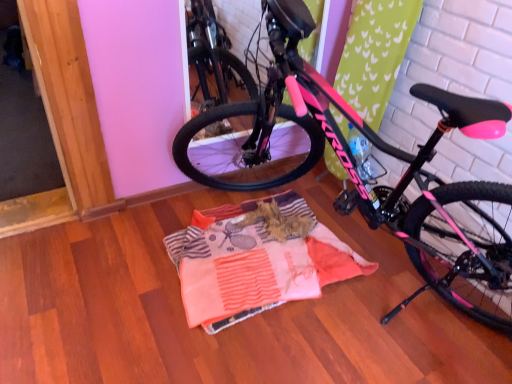
Question: Does striped cotton blanket at center have a smaller size compared to pink matte bicycle at center?

Choices:
 (A) yes
 (B) no

Answer: (A)

Question: Is striped cotton blanket at center far from pink matte bicycle at center?

Choices:
 (A) yes
 (B) no

Answer: (B)

Question: Is striped cotton blanket at center bigger than pink matte bicycle at center?

Choices:
 (A) no
 (B) yes

Answer: (A)

Question: Is striped cotton blanket at center closer to the viewer compared to pink matte bicycle at center?

Choices:
 (A) yes
 (B) no

Answer: (B)

Question: Is striped cotton blanket at center not within pink matte bicycle at center?

Choices:
 (A) no
 (B) yes

Answer: (A)

Question: Is striped cotton blanket at center with pink matte bicycle at center?

Choices:
 (A) no
 (B) yes

Answer: (A)

Question: Is pink matte bicycle at center oriented away from striped cotton blanket at center?

Choices:
 (A) no
 (B) yes

Answer: (A)

Question: Does pink matte bicycle at center have a lesser width compared to striped cotton blanket at center?

Choices:
 (A) no
 (B) yes

Answer: (A)

Question: Is pink matte bicycle at center facing towards striped cotton blanket at center?

Choices:
 (A) yes
 (B) no

Answer: (B)

Question: Does pink matte bicycle at center contain striped cotton blanket at center?

Choices:
 (A) no
 (B) yes

Answer: (B)

Question: Are pink matte bicycle at center and striped cotton blanket at center located far from each other?

Choices:
 (A) yes
 (B) no

Answer: (B)

Question: Are pink matte bicycle at center and striped cotton blanket at center beside each other?

Choices:
 (A) no
 (B) yes

Answer: (A)

Question: Is striped cotton blanket at center to the left or to the right of pink matte bicycle at center in the image?

Choices:
 (A) right
 (B) left

Answer: (B)